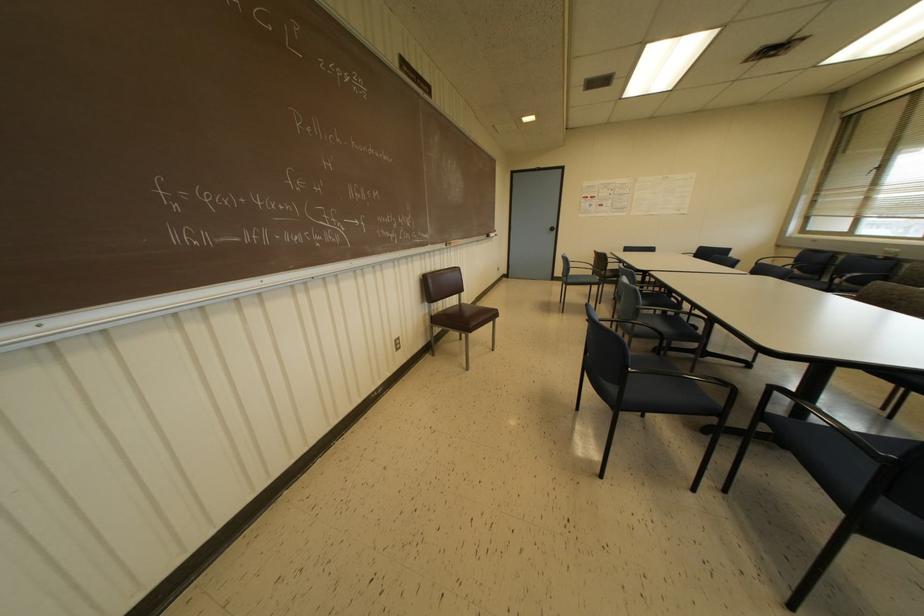
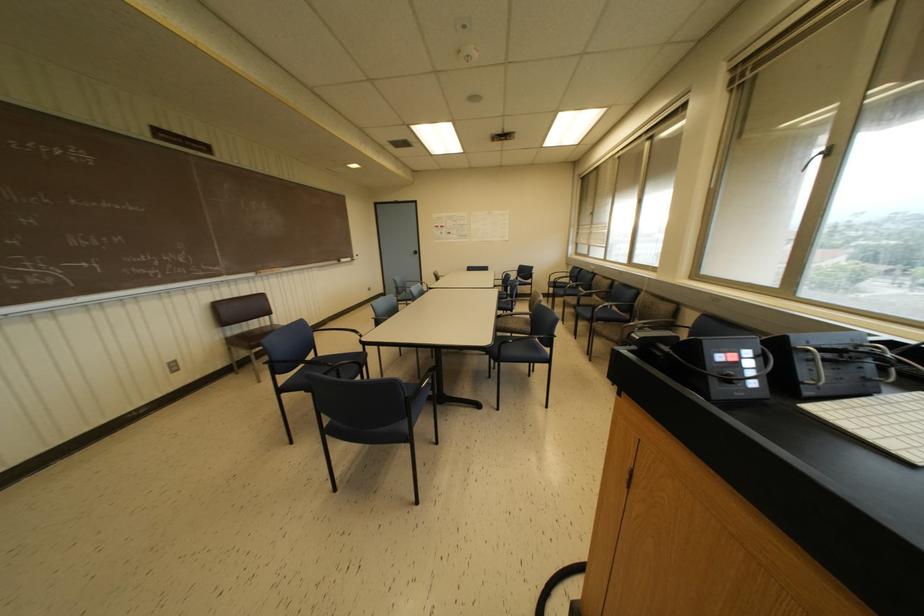
Looking at this image, in a continuous first-person perspective shot, in which direction is the camera moving?

The movement direction of the cameraman is right, backward.